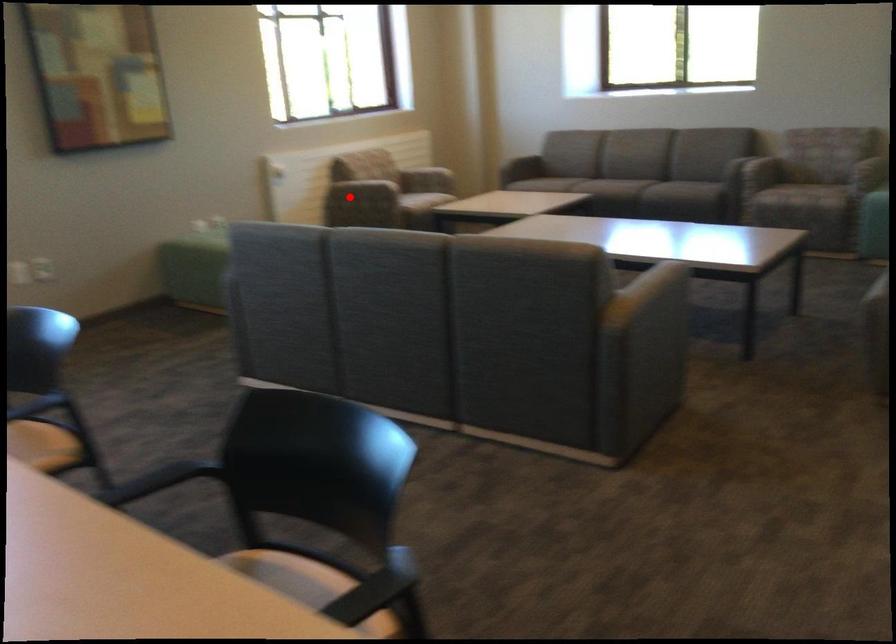
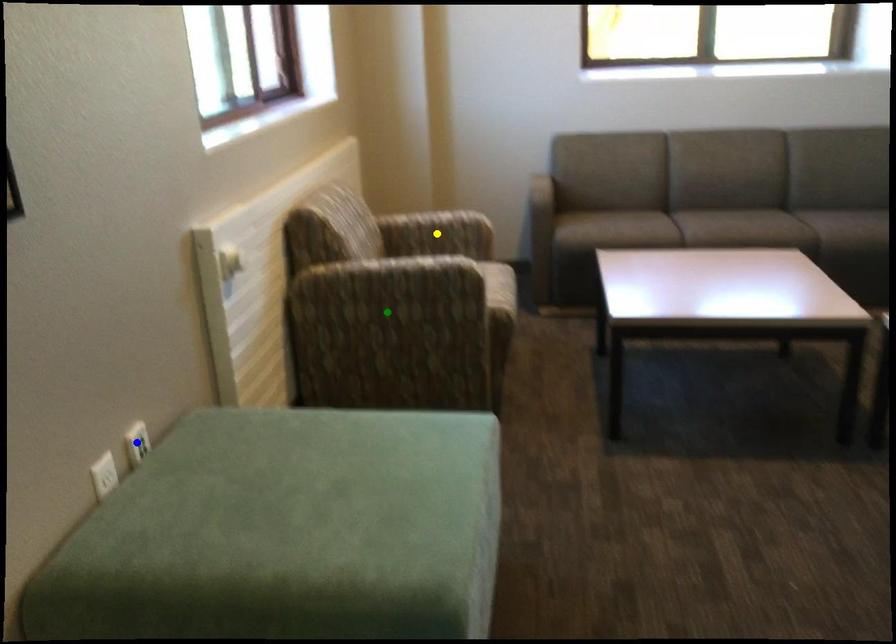
Question: I am providing you with two images of the same scene from different viewpoints. A red point is marked on the first image. You are given multiple points on the second image. In image 2, which mark is for the same physical point as the one in image 1?

Choices:
 (A) green point
 (B) blue point
 (C) yellow point

Answer: (A)